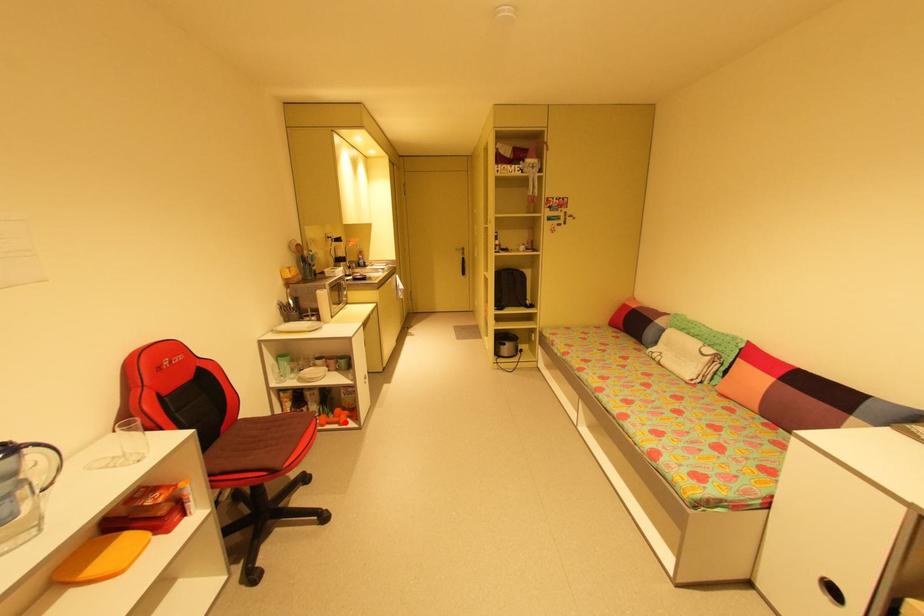
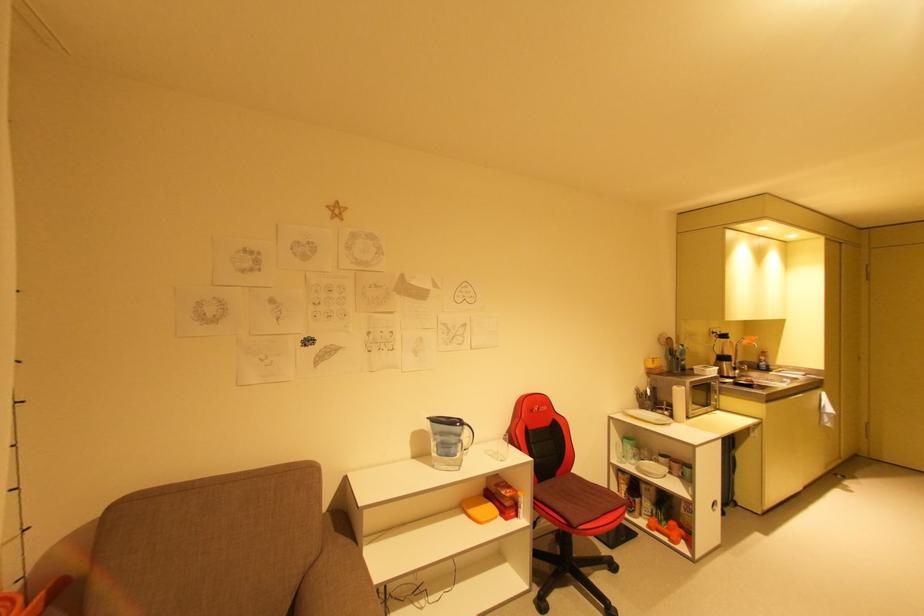
The point at the highlighted location is marked in the first image. Where is the corresponding point in the second image?

(675, 538)